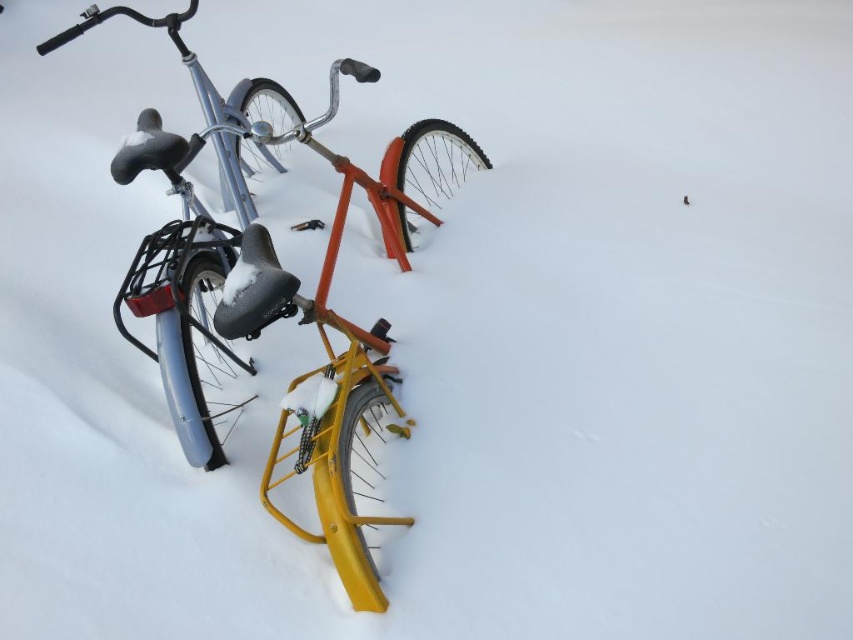
Does yellow matte bicycle at center appear on the left side of matte blue bicycle at left?

No, yellow matte bicycle at center is not to the left of matte blue bicycle at left.

Is yellow matte bicycle at center above matte blue bicycle at left?

Actually, yellow matte bicycle at center is below matte blue bicycle at left.

Find the location of a particular element. yellow matte bicycle at center is located at coordinates (329, 342).

Image resolution: width=853 pixels, height=640 pixels. What are the coordinates of `yellow matte bicycle at center` in the screenshot? It's located at (329, 342).